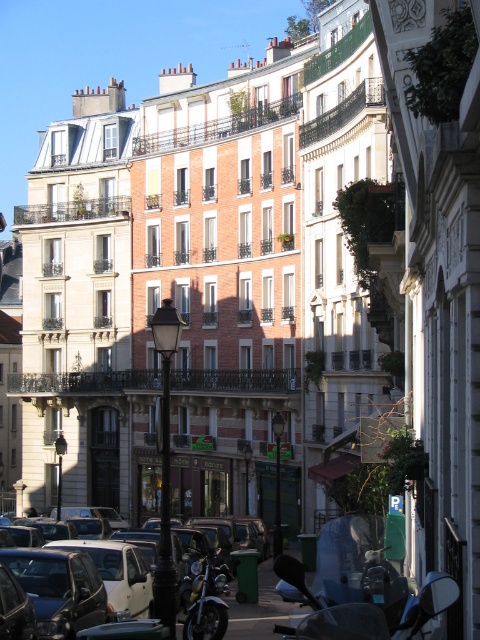
You are a delivery person needing to park your vehicle between two buildings on the street. The shiny chrome motorcycle at center and the white matte car at center are already parked there. Which vehicle takes up less space between the buildings?

The shiny chrome motorcycle at center is thinner than the white matte car at center, so it takes up less space between the buildings.